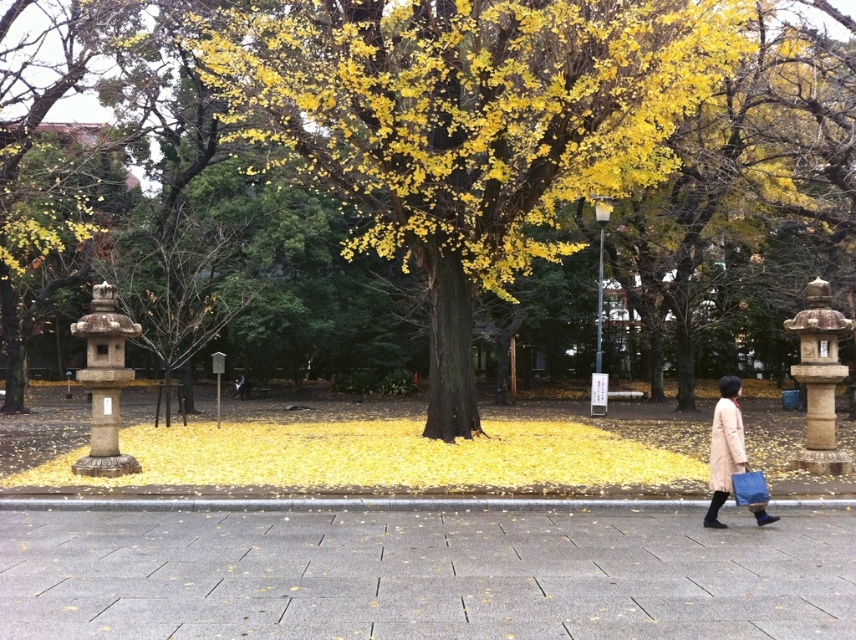
You are standing on the paved walkway between the two stone lanterns. You want to hang the beige wool coat at lower right on a hook located on the yellow leafy tree at center. Is the coat within reach of the hook?

The yellow leafy tree at center is much taller than the beige wool coat at lower right, so the coat cannot reach the hook on the tree.

You are a pedestrian standing on the gray concrete pavement at center. You want to walk towards the yellow leafy tree at center. Which direction should you move to get closer to the tree?

The gray concrete pavement at center is behind the yellow leafy tree at center, so to get closer to the yellow leafy tree at center, you should move forward towards it from the gray concrete pavement at center.